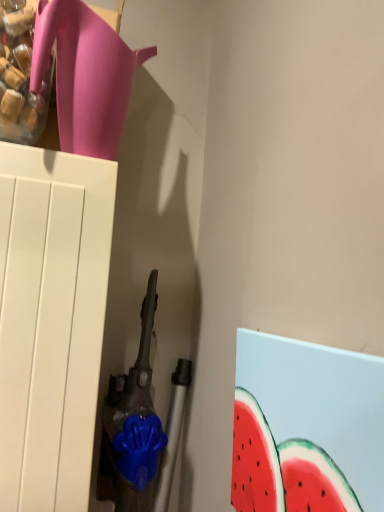
Question: Is matte pink jug at upper left wider than watermelon painted canvas at lower right?

Choices:
 (A) no
 (B) yes

Answer: (B)

Question: Can watermelon painted canvas at lower right be found inside matte pink jug at upper left?

Choices:
 (A) no
 (B) yes

Answer: (A)

Question: Is matte pink jug at upper left aimed at watermelon painted canvas at lower right?

Choices:
 (A) no
 (B) yes

Answer: (A)

Question: From a real-world perspective, is matte pink jug at upper left located higher than watermelon painted canvas at lower right?

Choices:
 (A) no
 (B) yes

Answer: (B)

Question: Is matte pink jug at upper left to the right of watermelon painted canvas at lower right from the viewer's perspective?

Choices:
 (A) no
 (B) yes

Answer: (A)

Question: Is matte pink jug at upper left positioned in front of watermelon painted canvas at lower right?

Choices:
 (A) no
 (B) yes

Answer: (A)

Question: Is watermelon painted canvas at lower right to the left of matte pink jug at upper left from the viewer's perspective?

Choices:
 (A) yes
 (B) no

Answer: (B)

Question: Is watermelon painted canvas at lower right far from matte pink jug at upper left?

Choices:
 (A) no
 (B) yes

Answer: (A)

Question: From the image's perspective, is watermelon painted canvas at lower right over matte pink jug at upper left?

Choices:
 (A) yes
 (B) no

Answer: (B)

Question: Could you tell me if watermelon painted canvas at lower right is facing matte pink jug at upper left?

Choices:
 (A) yes
 (B) no

Answer: (B)

Question: Does watermelon painted canvas at lower right have a greater width compared to matte pink jug at upper left?

Choices:
 (A) no
 (B) yes

Answer: (A)

Question: Is watermelon painted canvas at lower right shorter than matte pink jug at upper left?

Choices:
 (A) yes
 (B) no

Answer: (B)

Question: Considering their positions, is watermelon painted canvas at lower right located in front of or behind matte pink jug at upper left?

Choices:
 (A) behind
 (B) front

Answer: (B)